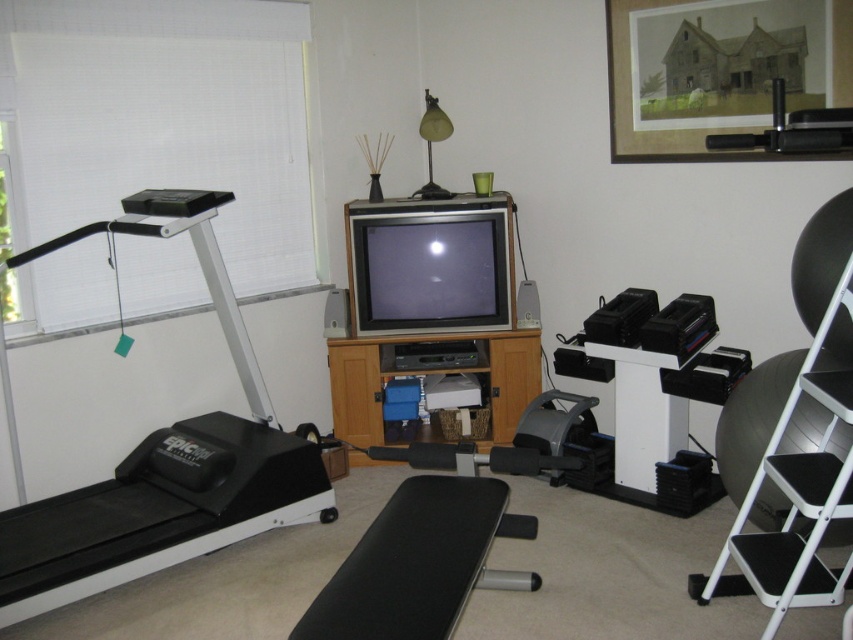
Can you confirm if black rubber treadmill at left is positioned to the left of wooden framed picture at upper center?

Yes, black rubber treadmill at left is to the left of wooden framed picture at upper center.

Identify the location of black rubber treadmill at left. (163, 460).

Where is `black rubber treadmill at left`? black rubber treadmill at left is located at coordinates (163, 460).

Who is positioned more to the right, black rubber treadmill at left or black rubber barbell at upper right?

black rubber barbell at upper right

Can you confirm if black rubber treadmill at left is positioned below black rubber barbell at upper right?

Correct, black rubber treadmill at left is located below black rubber barbell at upper right.

Which is in front, point (76, 504) or point (767, 150)?

Positioned in front is point (767, 150).

Identify the location of black rubber treadmill at left. (163, 460).

Can you confirm if white matte step ladder at right is thinner than black rubber barbell at upper right?

No, white matte step ladder at right is not thinner than black rubber barbell at upper right.

From the picture: Does white matte step ladder at right lie in front of black rubber barbell at upper right?

Yes, white matte step ladder at right is in front of black rubber barbell at upper right.

The width and height of the screenshot is (853, 640). Find the location of `white matte step ladder at right`. white matte step ladder at right is located at coordinates (798, 493).